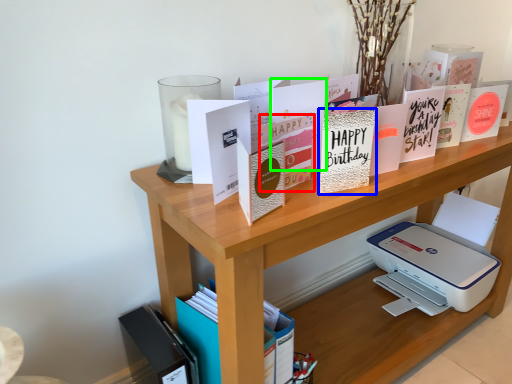
Question: Based on their relative distances, which object is farther from paperback book (highlighted by a red box)? Choose from paperback book (highlighted by a blue box) and paperback book (highlighted by a green box).

Choices:
 (A) paperback book
 (B) paperback book

Answer: (A)